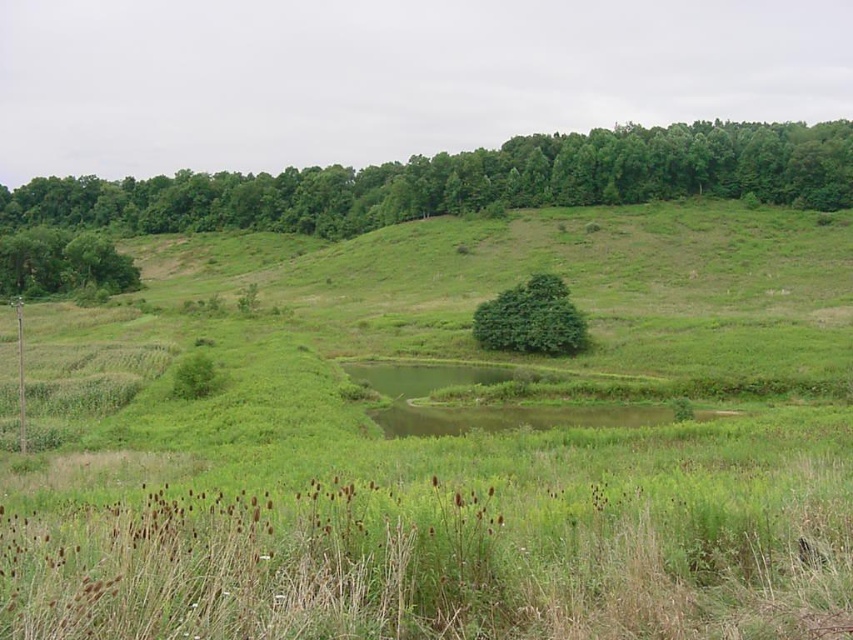
Who is shorter, green leafy tree at upper center or green leafy tree at center?

Standing shorter between the two is green leafy tree at center.

Between point (627, 161) and point (527, 348), which one is positioned behind?

Positioned behind is point (627, 161).

Find the location of `green leafy tree at upper center`. green leafy tree at upper center is located at coordinates (465, 180).